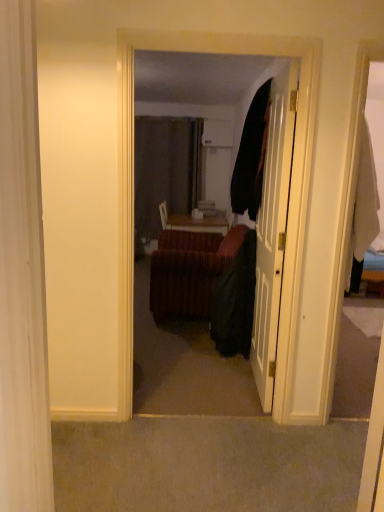
You are a GUI agent. You are given a task and a screenshot of the screen. Output one action in this format:
    pyautogui.click(x=<x>, y=<y>)
    Task: Click on the free spot to the right of velvet couch at center
    
    Given the screenshot: What is the action you would take?
    pyautogui.click(x=267, y=439)